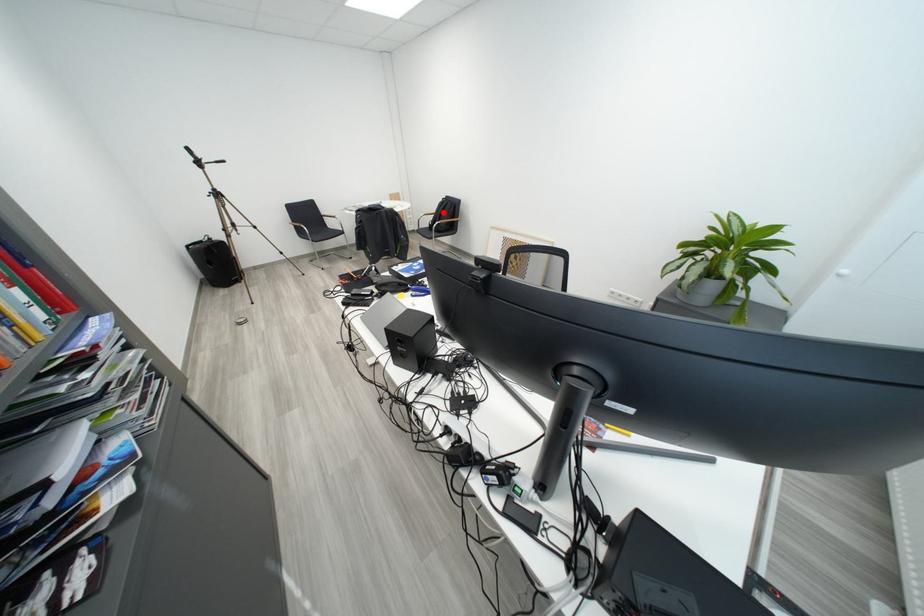
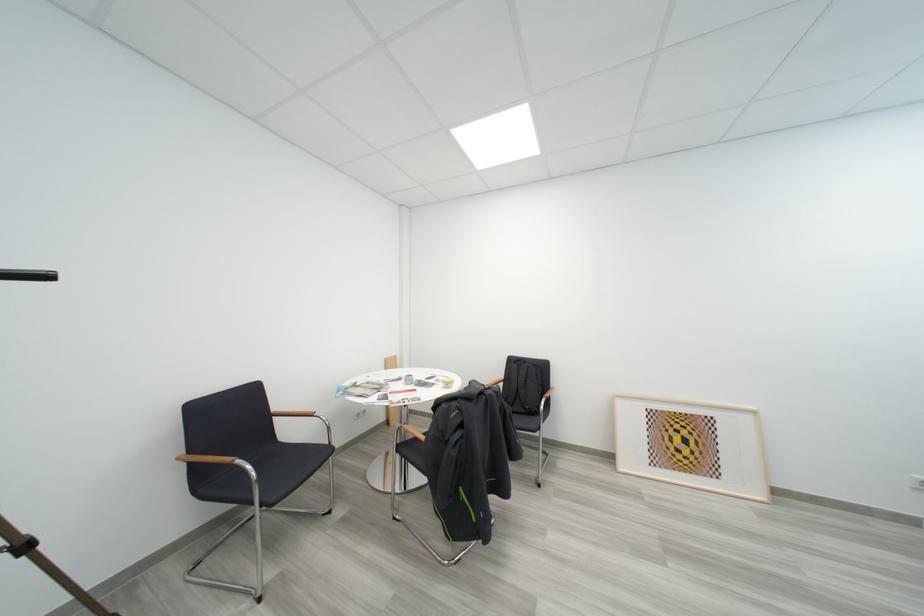
In the second image, find the point that corresponds to the highlighted location in the first image.

(512, 381)